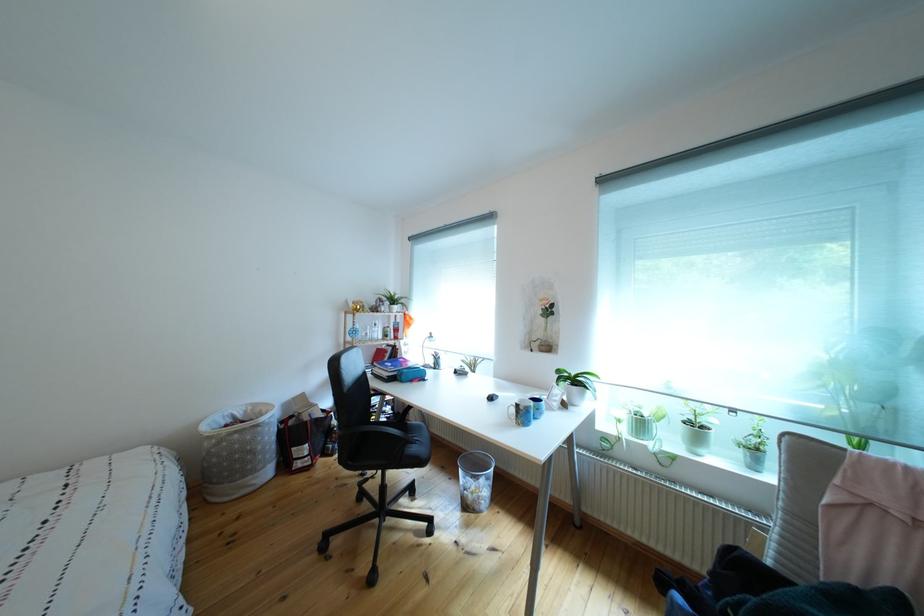
Find the location of a particular element. The image size is (924, 616). black computer mouse is located at coordinates (492, 397).